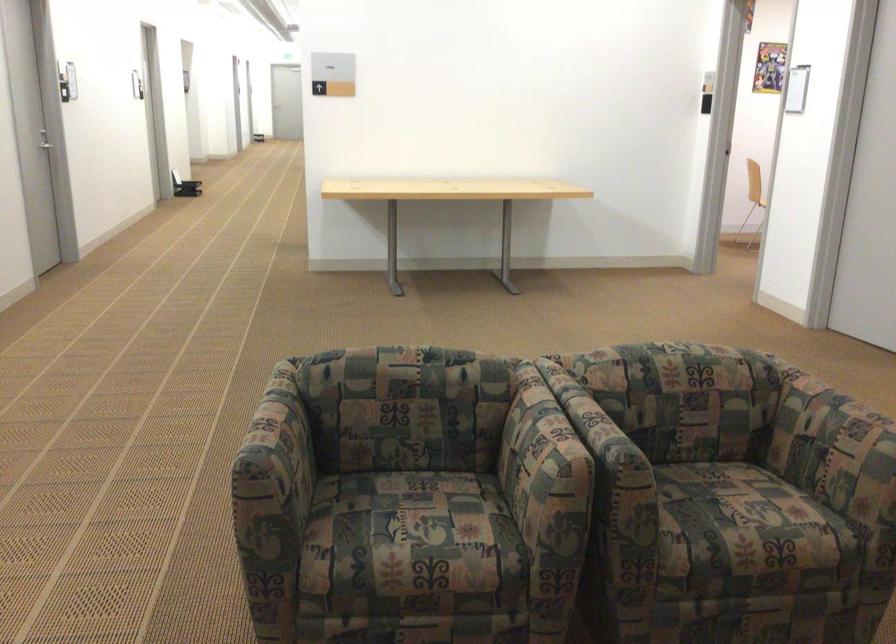
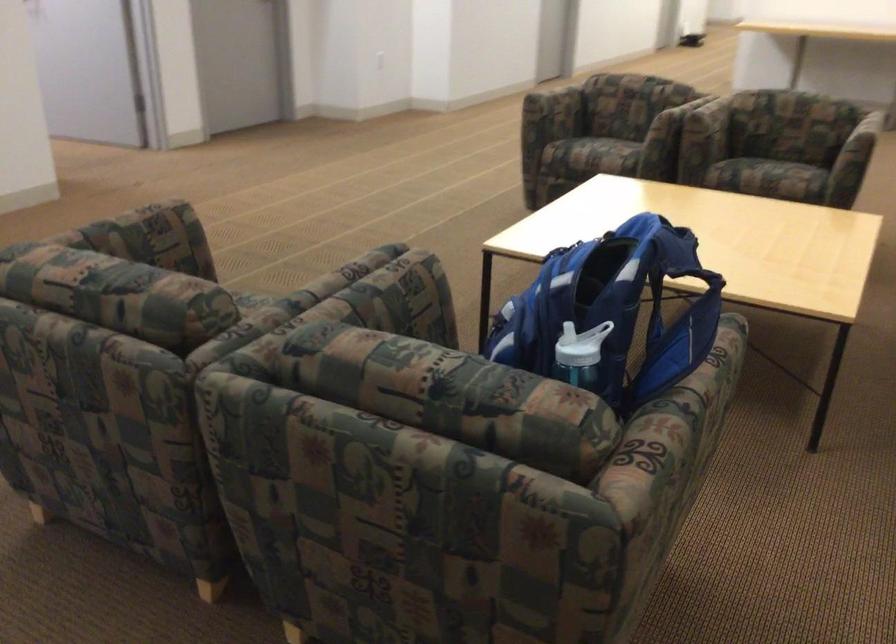
Question: I am providing you with two images of the same scene from different viewpoints. Please identify which objects are invisible in image2.

Choices:
 (A) white projector
 (B) patterned chair sitting surface
 (C) chair sitting surface
 (D) chair armrest

Answer: (B)